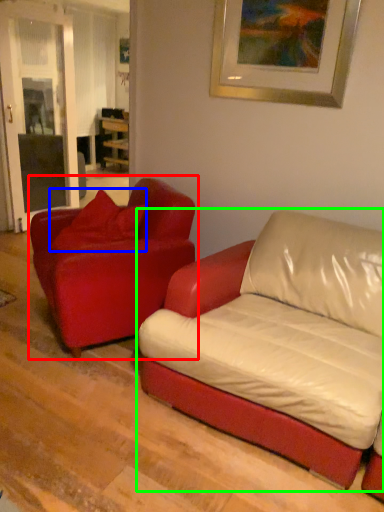
Question: Which is nearer to the studio couch (highlighted by a red box)? pillow (highlighted by a blue box) or studio couch (highlighted by a green box).

Choices:
 (A) pillow
 (B) studio couch

Answer: (A)